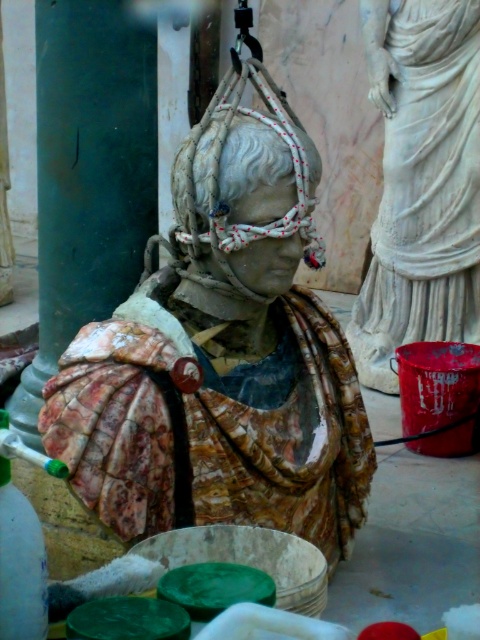
You are an art conservator working on the sculpture. You need to reach a specific point on the sculpture for restoration. The point is located at coordinates point (90, 490). Given that your arm can extend 1.5 meters, can you reach that point without moving the sculpture?

The point (90, 490) is 2.69 meters from the camera, which is farther than your arm can reach. You will need to move the sculpture closer or use a longer tool to reach it.

You are an art conservator working on the sculpture. Your tools are placed on a table 3 meters away from the camera. If you want to reach them without moving, can you do so while standing at the marble bust at center?

The marble bust at center is 2.62 meters away from the camera. The tools are 3 meters away from the camera, so they are 0.38 meters farther than the bust. Since you are at the marble bust at center, you cannot reach the tools on the table 3 meters away from the camera without moving.

You are an art conservator assessing the workspace. You need to determine if the marble bust at center can fit through a doorway that is narrower than the white marble statue at upper right. Can it?

The marble bust at center is wider than the white marble statue at upper right. Since the doorway is narrower than the statue, the marble bust at center cannot fit through the doorway.